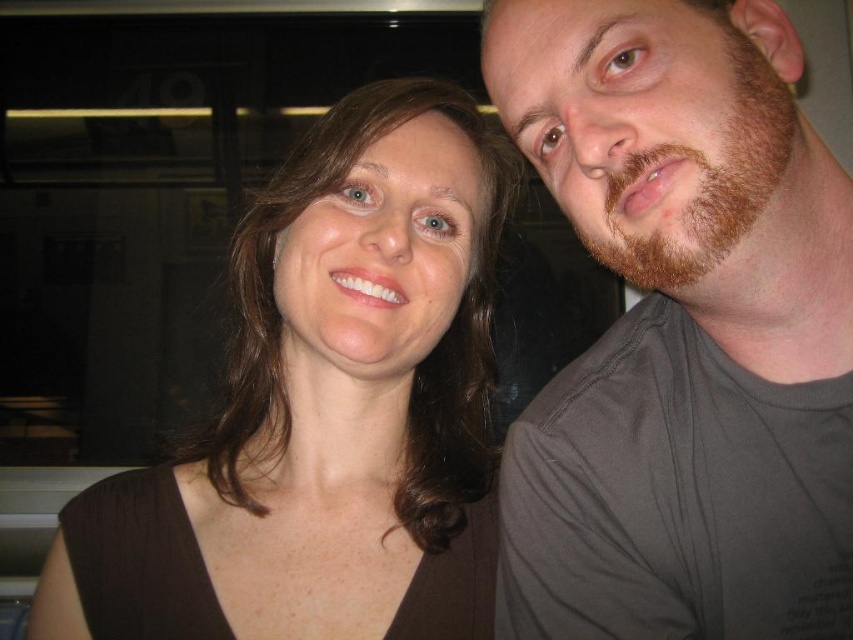
Can you confirm if dark gray t-shirt at right is positioned above brown matte shirt at center?

Yes, dark gray t-shirt at right is above brown matte shirt at center.

Is point (677, 340) less distant than point (381, 449)?

Yes.

Image resolution: width=853 pixels, height=640 pixels. Describe the element at coordinates (682, 330) in the screenshot. I see `dark gray t-shirt at right` at that location.

Image resolution: width=853 pixels, height=640 pixels. Identify the location of dark gray t-shirt at right. click(x=682, y=330).

Between point (457, 352) and point (746, 148), which one is positioned behind?

Point (457, 352)

Where is `brown matte shirt at center`? This screenshot has width=853, height=640. brown matte shirt at center is located at coordinates (325, 410).

This screenshot has width=853, height=640. In order to click on brown matte shirt at center in this screenshot , I will do pos(325,410).

Is point (509, 532) positioned in front of point (756, 209)?

No, (509, 532) is behind (756, 209).

Who is positioned more to the right, dark gray t-shirt at right or brown fuzzy beard at right?

dark gray t-shirt at right

Describe the element at coordinates (682, 330) in the screenshot. I see `dark gray t-shirt at right` at that location.

This screenshot has width=853, height=640. What are the coordinates of `dark gray t-shirt at right` in the screenshot? It's located at (682, 330).